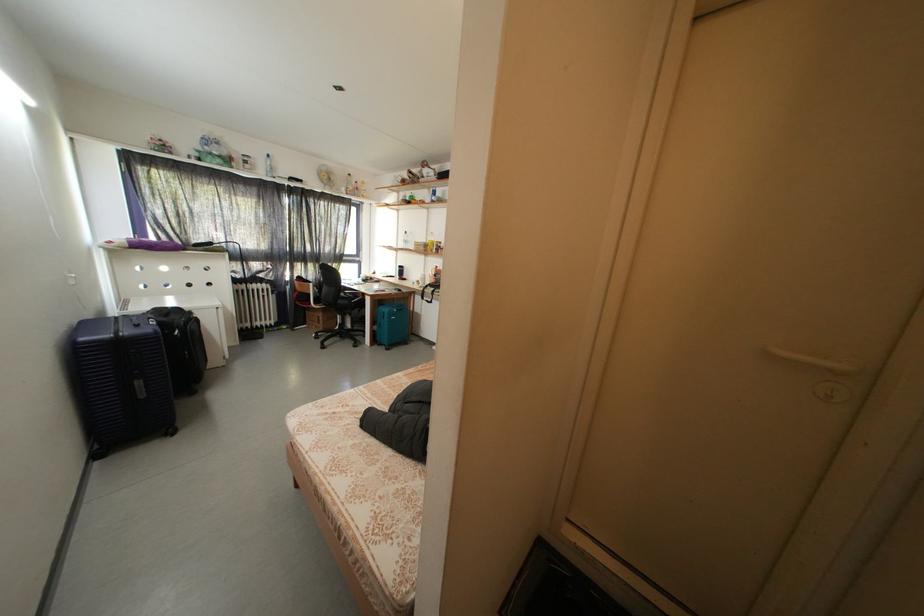
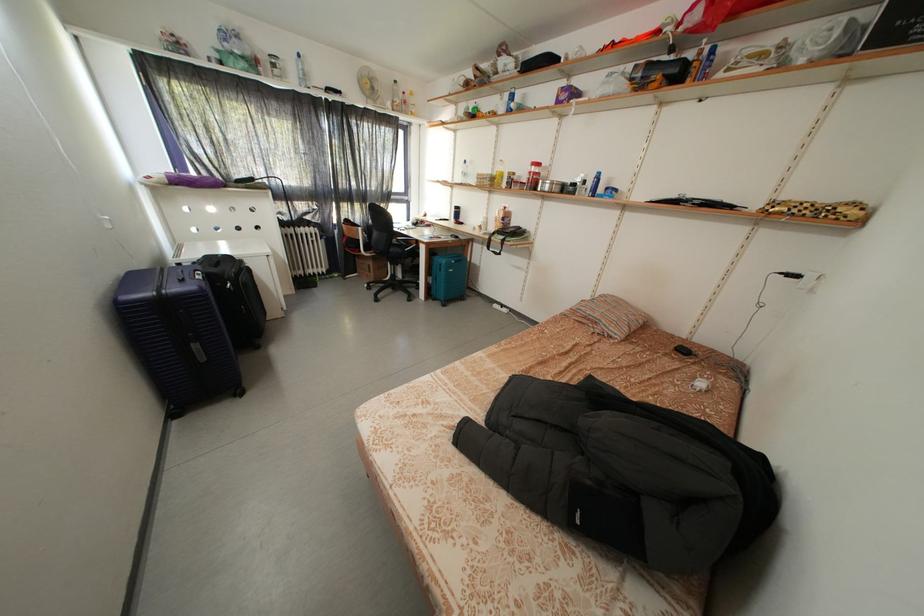
The point at (347, 307) is marked in the first image. Where is the corresponding point in the second image?

(399, 254)